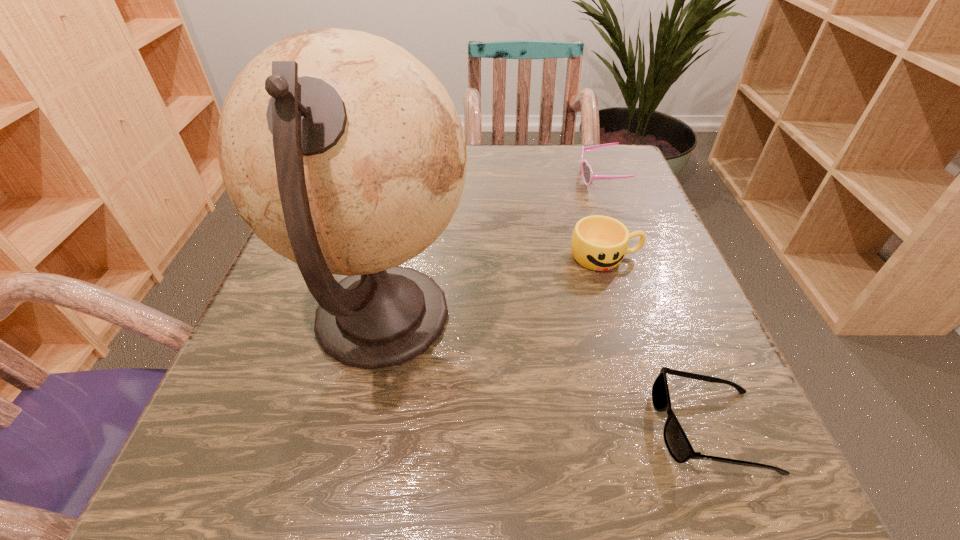
At what (x,y) coordinates should I click in order to perform the action: click on vacant space that is in between the farther sunglasses and the nearer sunglasses. Please return your answer as a coordinate pair (x, y). Looking at the image, I should click on (655, 303).

Find the location of a particular element. free spot between the globe and the cup is located at coordinates (493, 287).

You are a GUI agent. You are given a task and a screenshot of the screen. Output one action in this format:
    pyautogui.click(x=<x>, y=<y>)
    Task: Click on the free space between the farther sunglasses and the shortest object
    
    Given the screenshot: What is the action you would take?
    [655, 303]

The image size is (960, 540). What are the coordinates of `object that ranks as the third closest to the farthest object` in the screenshot? It's located at (677, 443).

Point out which object is positioned as the nearest to the farther sunglasses. Please provide its 2D coordinates. Your answer should be formatted as a tuple, i.e. [(x, y)], where the tuple contains the x and y coordinates of a point satisfying the conditions above.

[(599, 243)]